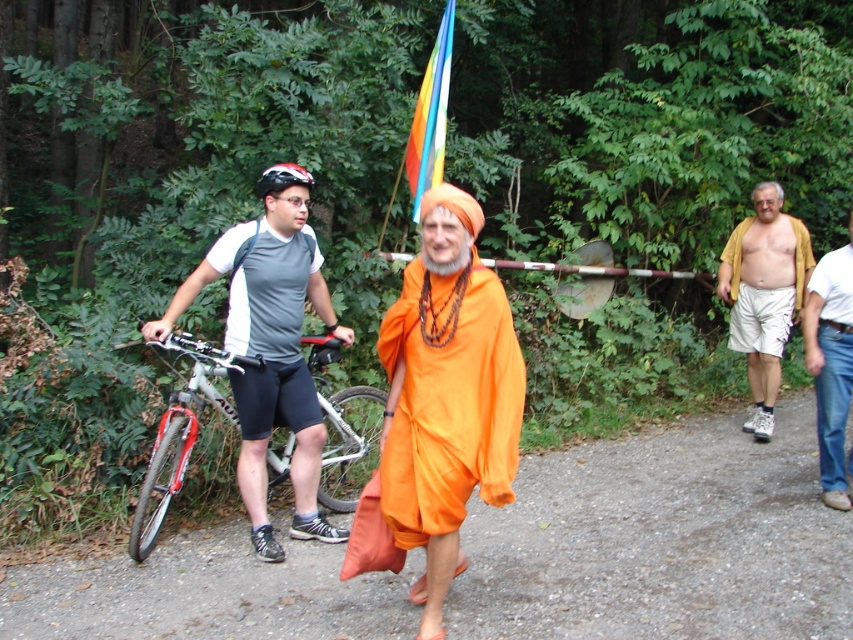
You are planning to carry a large backpack while walking along the gravel path in the forest. Considering the space between the silver metallic bicycle at left and the tan fabric shirt at right, do you think there is enough room for you to pass through comfortably?

The silver metallic bicycle at left has a lesser width compared to tan fabric shirt at right, so there is enough space between them for you to pass through comfortably with your large backpack.

You are a photographer standing at the end of the gravel path in the forest scene. You want to take a photo that includes both the orange fabric dhoti at center and the white cotton shirt at right. Which of these two clothing items will appear larger in the photo due to their sizes?

The orange fabric dhoti at center appears larger in the photo because it is much taller than the white cotton shirt at right.

You are a hiker trying to decide whether to carry your silver metallic bicycle at left up a steep hill. The tan fabric shirt at right is standing nearby. Which object is shorter in height?

The silver metallic bicycle at left is not as tall as the tan fabric shirt at right, so the bicycle is shorter.